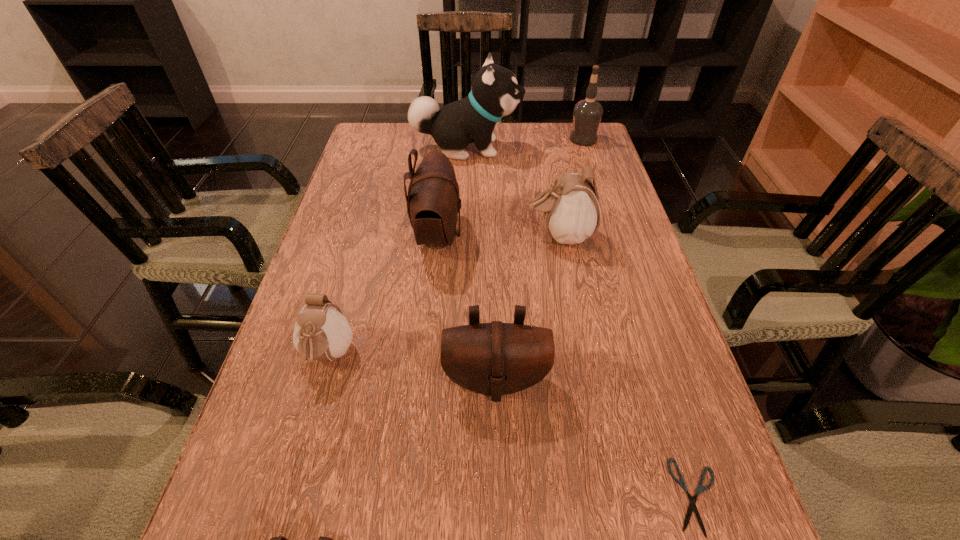
Locate an element on the screen. This screenshot has width=960, height=540. vacant space located 0.080m on the left of the shears is located at coordinates (617, 496).

Where is `puppy situated at the far edge`? puppy situated at the far edge is located at coordinates (495, 93).

Where is `vodka that is at the far edge`? The width and height of the screenshot is (960, 540). vodka that is at the far edge is located at coordinates (587, 114).

You are a GUI agent. You are given a task and a screenshot of the screen. Output one action in this format:
    pyautogui.click(x=<x>, y=<y>)
    Task: Click on the object that is at the left edge
    Image resolution: width=960 pixels, height=540 pixels.
    Given the screenshot: What is the action you would take?
    pyautogui.click(x=321, y=332)

Image resolution: width=960 pixels, height=540 pixels. I want to click on vodka present at the right edge, so click(x=587, y=114).

Where is `pouch at the right edge`? The width and height of the screenshot is (960, 540). pouch at the right edge is located at coordinates (571, 210).

This screenshot has width=960, height=540. I want to click on shears located at the right edge, so click(x=692, y=505).

Where is `object present at the far right corner`? object present at the far right corner is located at coordinates (587, 114).

In the image, there is a desktop. What are the coordinates of `vacant space at the far edge` in the screenshot? It's located at (428, 143).

Where is `vacant space at the left edge of the desktop`? The width and height of the screenshot is (960, 540). vacant space at the left edge of the desktop is located at coordinates [x=382, y=204].